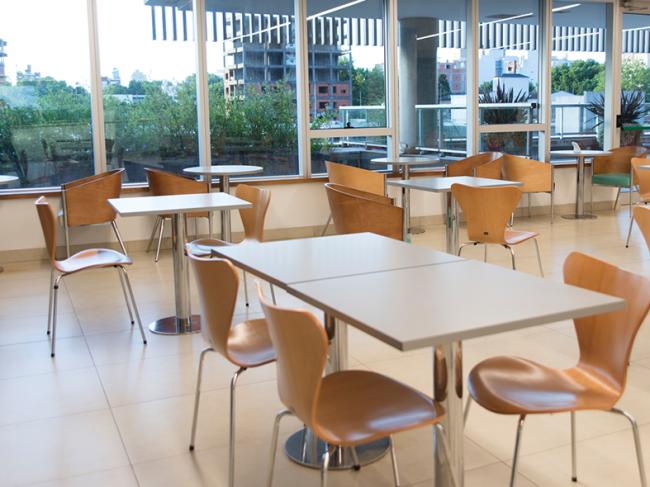
This screenshot has height=487, width=650. I want to click on tables, so click(x=422, y=289), click(x=341, y=257), click(x=171, y=205), click(x=226, y=170), click(x=406, y=159), click(x=439, y=182), click(x=588, y=152).